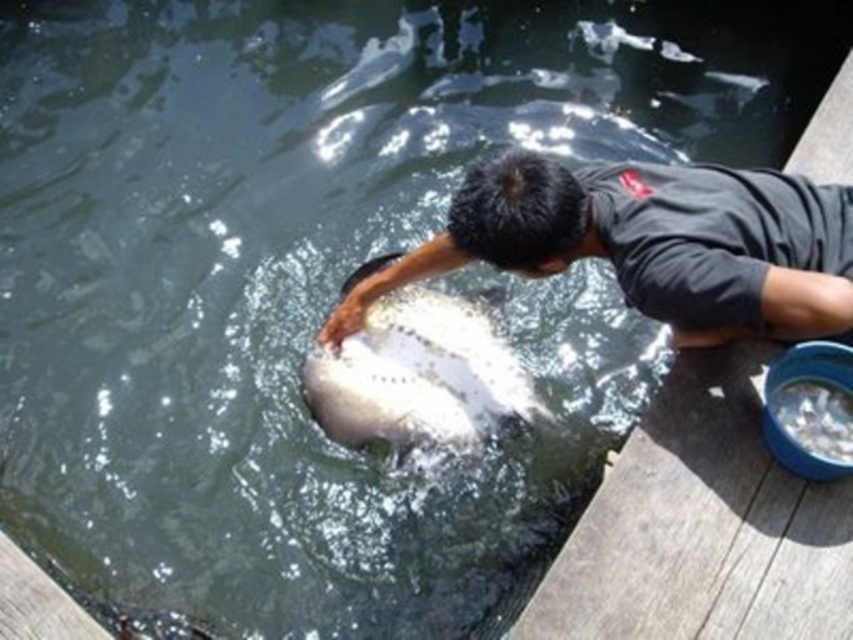
Question: Which is farther from the white speckled fish at center?

Choices:
 (A) wooden dock at lower right
 (B) dark gray shirt at upper center

Answer: (A)

Question: Can you confirm if wooden dock at lower right is positioned to the left of dark gray shirt at upper center?

Choices:
 (A) yes
 (B) no

Answer: (B)

Question: Which is nearer to the dark gray shirt at upper center?

Choices:
 (A) white speckled fish at center
 (B) wooden dock at lower right

Answer: (A)

Question: Can you confirm if dark gray shirt at upper center is positioned below white speckled fish at center?

Choices:
 (A) yes
 (B) no

Answer: (B)

Question: Which object appears farthest from the camera in this image?

Choices:
 (A) white speckled fish at center
 (B) dark gray shirt at upper center
 (C) wooden dock at lower right

Answer: (A)

Question: Is wooden dock at lower right closer to the viewer compared to dark gray shirt at upper center?

Choices:
 (A) yes
 (B) no

Answer: (A)